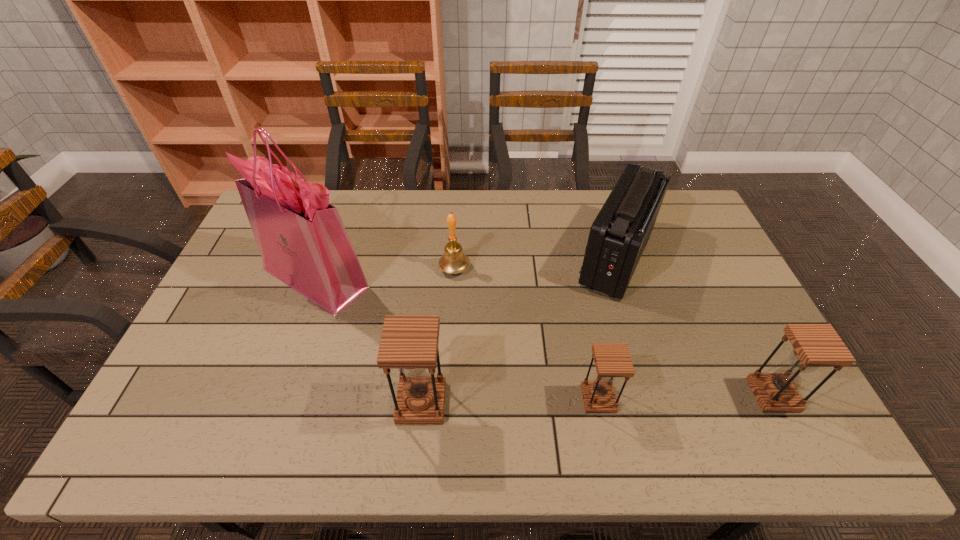
Locate an element on the screen. the tallest hourglass is located at coordinates (408, 342).

This screenshot has width=960, height=540. Find the location of `the shortest hourglass`. the shortest hourglass is located at coordinates (612, 360).

Image resolution: width=960 pixels, height=540 pixels. Find the location of `the shortest object`. the shortest object is located at coordinates (612, 360).

The width and height of the screenshot is (960, 540). Find the location of `the rightmost object`. the rightmost object is located at coordinates (814, 345).

Locate an element on the screen. This screenshot has height=540, width=960. the second tallest hourglass is located at coordinates (814, 345).

What are the coordinates of `bell` in the screenshot? It's located at (454, 261).

The width and height of the screenshot is (960, 540). I want to click on shopping bag, so (303, 242).

The image size is (960, 540). I want to click on the tallest object, so click(303, 242).

Image resolution: width=960 pixels, height=540 pixels. In order to click on radio receiver in this screenshot , I will do `click(618, 236)`.

You are a GUI agent. You are given a task and a screenshot of the screen. Output one action in this format:
    pyautogui.click(x=<x>, y=<y>)
    Task: Click on the free space located 0.220m on the left of the leftmost hourglass
    This screenshot has height=540, width=960.
    Given the screenshot: What is the action you would take?
    pyautogui.click(x=309, y=403)